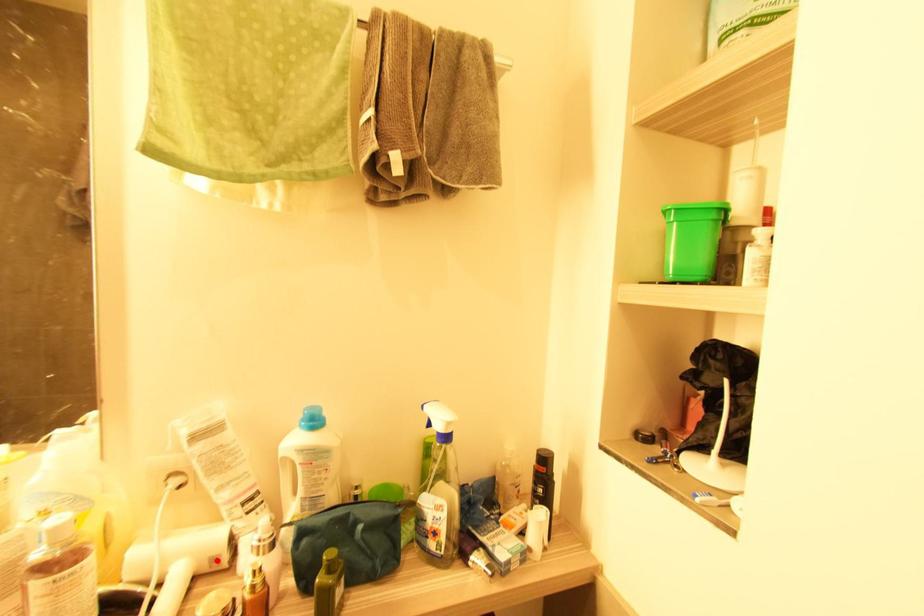
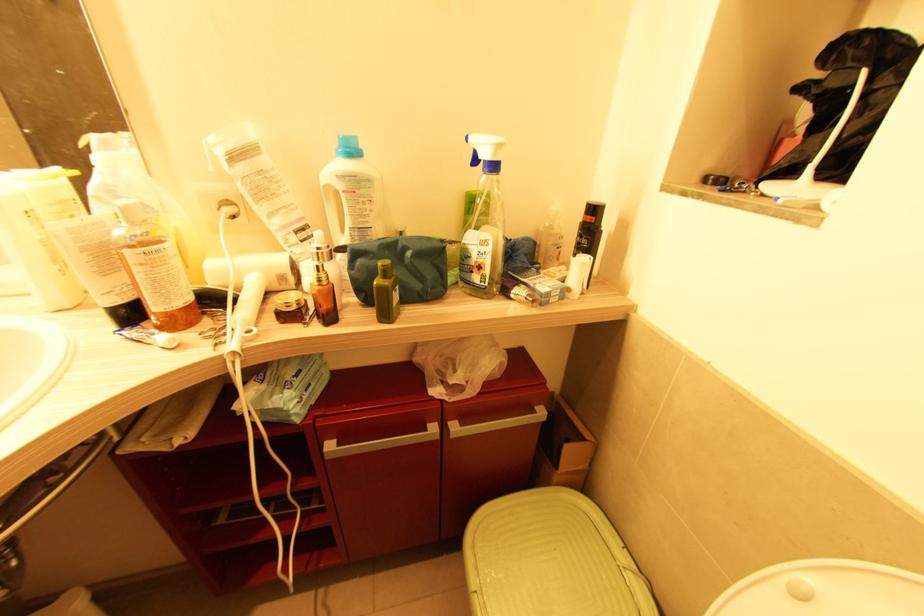
The point at the highlighted location is marked in the first image. Where is the corresponding point in the second image?

(284, 278)